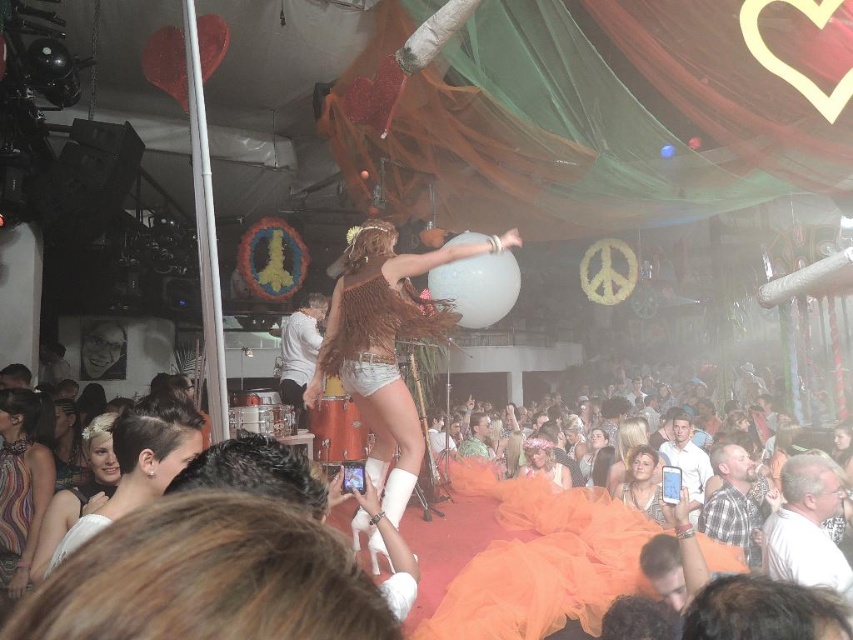
Does matte white dress at lower left have a lesser height compared to matte gold dress at center?

No.

Which of these two, matte white dress at lower left or matte gold dress at center, stands taller?

matte white dress at lower left is taller.

Locate an element on the screen. matte white dress at lower left is located at coordinates (67, 444).

Where is `matte white dress at lower left`? This screenshot has width=853, height=640. matte white dress at lower left is located at coordinates (67, 444).

Measure the distance between white lace dress at lower left and blonde hair at center.

white lace dress at lower left and blonde hair at center are 12.47 feet apart.

Between point (7, 460) and point (618, 458), which one is positioned behind?

Positioned behind is point (618, 458).

The width and height of the screenshot is (853, 640). What do you see at coordinates (21, 483) in the screenshot? I see `white lace dress at lower left` at bounding box center [21, 483].

At what (x,y) coordinates should I click in order to perform the action: click on white lace dress at lower left. Please return your answer as a coordinate pair (x, y). The image size is (853, 640). Looking at the image, I should click on (21, 483).

Who is more forward, (596,589) or (596,465)?

Point (596,589) is more forward.

Is orange tulle dress at lower center bigger than matte gold dress at center?

Correct, orange tulle dress at lower center is larger in size than matte gold dress at center.

Which is behind, point (440, 467) or point (587, 449)?

The point (587, 449) is more distant.

The width and height of the screenshot is (853, 640). In order to click on orange tulle dress at lower center in this screenshot , I will do `click(538, 560)`.